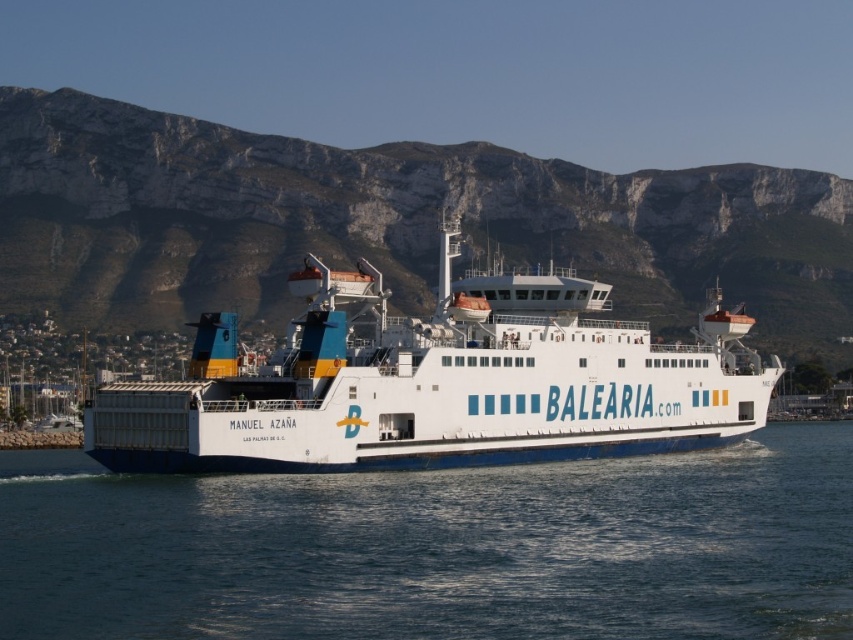
Does blue water at center lie behind white rocky mountain at upper center?

No, it is not.

Is blue water at center to the left of white rocky mountain at upper center from the viewer's perspective?

Correct, you'll find blue water at center to the left of white rocky mountain at upper center.

Locate an element on the screen. blue water at center is located at coordinates (438, 548).

Where is `blue water at center`? Image resolution: width=853 pixels, height=640 pixels. blue water at center is located at coordinates (438, 548).

Can you confirm if white rocky mountain at upper center is positioned below white matte ferry at center?

No.

Locate an element on the screen. white rocky mountain at upper center is located at coordinates coord(389,221).

I want to click on white rocky mountain at upper center, so click(x=389, y=221).

Find the location of a particular element. The height and width of the screenshot is (640, 853). white rocky mountain at upper center is located at coordinates pyautogui.click(x=389, y=221).

Can you confirm if blue water at center is positioned above white matte ferry at center?

No.

Does blue water at center have a smaller size compared to white matte ferry at center?

Yes.

Between point (56, 456) and point (751, 416), which one is positioned behind?

The point (56, 456) is behind.

In order to click on blue water at center in this screenshot , I will do `click(438, 548)`.